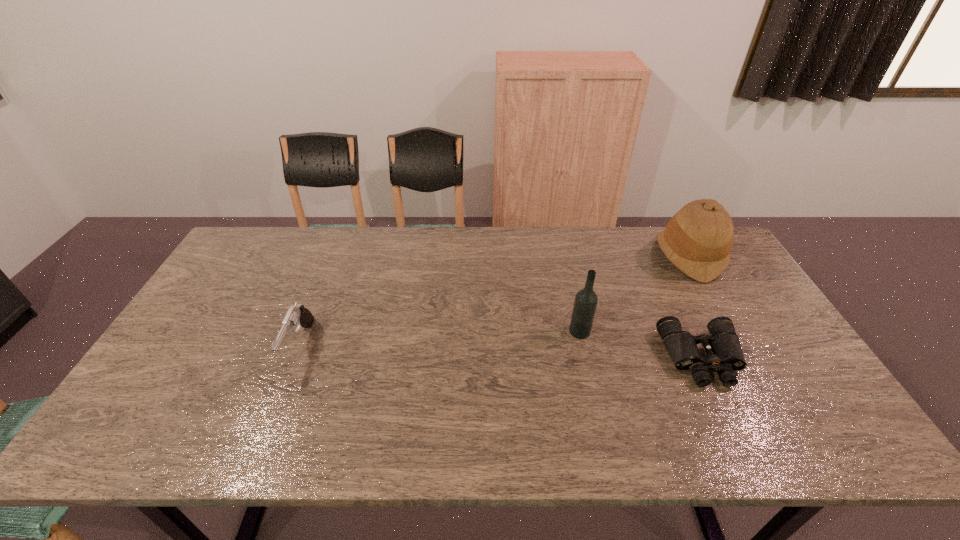
Select which object is the second closest to the vodka. Please provide its 2D coordinates. Your answer should be formatted as a tuple, i.e. [(x, y)], where the tuple contains the x and y coordinates of a point satisfying the conditions above.

[(698, 239)]

Locate an element on the screen. This screenshot has height=540, width=960. object that is the third nearest to the binoculars is located at coordinates (297, 315).

The image size is (960, 540). I want to click on vacant space that satisfies the following two spatial constraints: 1. on the front-facing side of the hat; 2. through the eyepieces of the binoculars, so click(747, 358).

Where is `blank space that satisfies the following two spatial constraints: 1. on the front-facing side of the farthest object; 2. at the muzzle of the gun`? blank space that satisfies the following two spatial constraints: 1. on the front-facing side of the farthest object; 2. at the muzzle of the gun is located at coordinates (740, 346).

Where is `free spot that satisfies the following two spatial constraints: 1. on the front-facing side of the hat; 2. at the muzzle of the gun`? free spot that satisfies the following two spatial constraints: 1. on the front-facing side of the hat; 2. at the muzzle of the gun is located at coordinates (740, 346).

The height and width of the screenshot is (540, 960). What are the coordinates of `free location that satisfies the following two spatial constraints: 1. on the front-facing side of the farthest object; 2. at the muzzle of the second shortest object` in the screenshot? It's located at (740, 346).